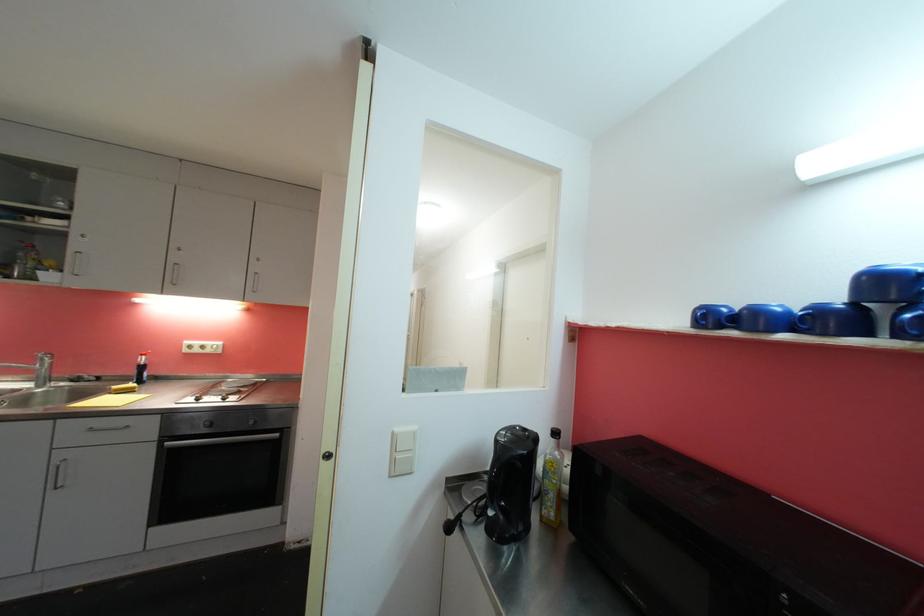
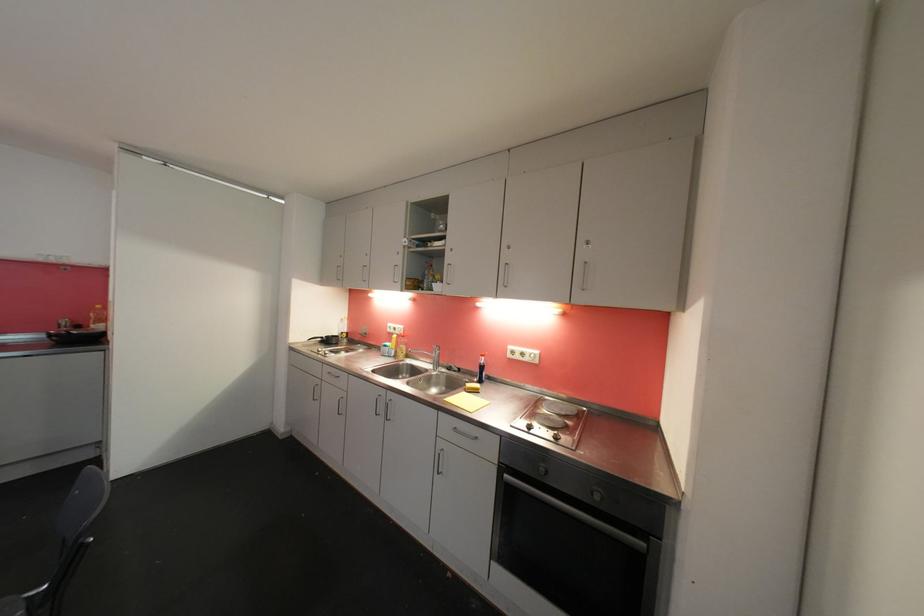
Question: The camera is either moving clockwise (left) or counter-clockwise (right) around the object. The first image is from the beginning of the video and the second image is from the end. Is the camera moving left or right when shooting the video?

Choices:
 (A) Left
 (B) Right

Answer: (B)